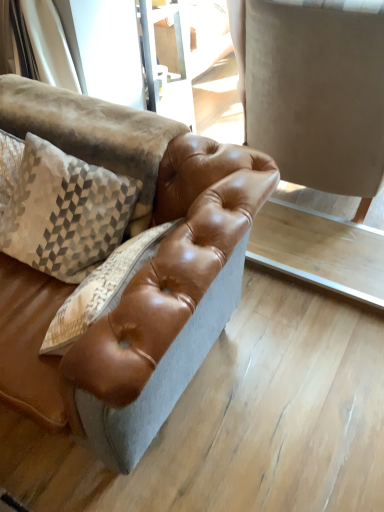
Question: Does textured beige pillow at upper left have a greater width compared to light brown leather table at center?

Choices:
 (A) no
 (B) yes

Answer: (A)

Question: Can you confirm if textured beige pillow at upper left is positioned to the left of light brown leather table at center?

Choices:
 (A) yes
 (B) no

Answer: (A)

Question: Does textured beige pillow at upper left have a greater height compared to light brown leather table at center?

Choices:
 (A) yes
 (B) no

Answer: (A)

Question: From a real-world perspective, does textured beige pillow at upper left sit lower than light brown leather table at center?

Choices:
 (A) no
 (B) yes

Answer: (A)

Question: Is textured beige pillow at upper left positioned beyond the bounds of light brown leather table at center?

Choices:
 (A) yes
 (B) no

Answer: (A)

Question: Is point (94, 203) positioned closer to the camera than point (329, 274)?

Choices:
 (A) farther
 (B) closer

Answer: (B)

Question: From their relative heights in the image, would you say textured beige pillow at upper left is taller or shorter than light brown leather table at center?

Choices:
 (A) tall
 (B) short

Answer: (A)

Question: From the image's perspective, is textured beige pillow at upper left above or below light brown leather table at center?

Choices:
 (A) below
 (B) above

Answer: (B)

Question: Considering the positions of textured beige pillow at upper left and light brown leather table at center in the image, is textured beige pillow at upper left wider or thinner than light brown leather table at center?

Choices:
 (A) wide
 (B) thin

Answer: (B)

Question: Is brown leather swivel chair at center spatially inside textured beige pillow at upper left, or outside of it?

Choices:
 (A) outside
 (B) inside

Answer: (A)

Question: Is point (292, 139) positioned closer to the camera than point (112, 199)?

Choices:
 (A) farther
 (B) closer

Answer: (A)

Question: Relative to textured beige pillow at upper left, is brown leather swivel chair at center in front or behind?

Choices:
 (A) behind
 (B) front

Answer: (A)

Question: In terms of width, does brown leather swivel chair at center look wider or thinner when compared to textured beige pillow at upper left?

Choices:
 (A) wide
 (B) thin

Answer: (A)

Question: Does point click(286, 231) appear closer or farther from the camera than point click(269, 65)?

Choices:
 (A) farther
 (B) closer

Answer: (A)

Question: Would you say light brown leather table at center is to the left or to the right of brown leather swivel chair at center in the picture?

Choices:
 (A) right
 (B) left

Answer: (B)